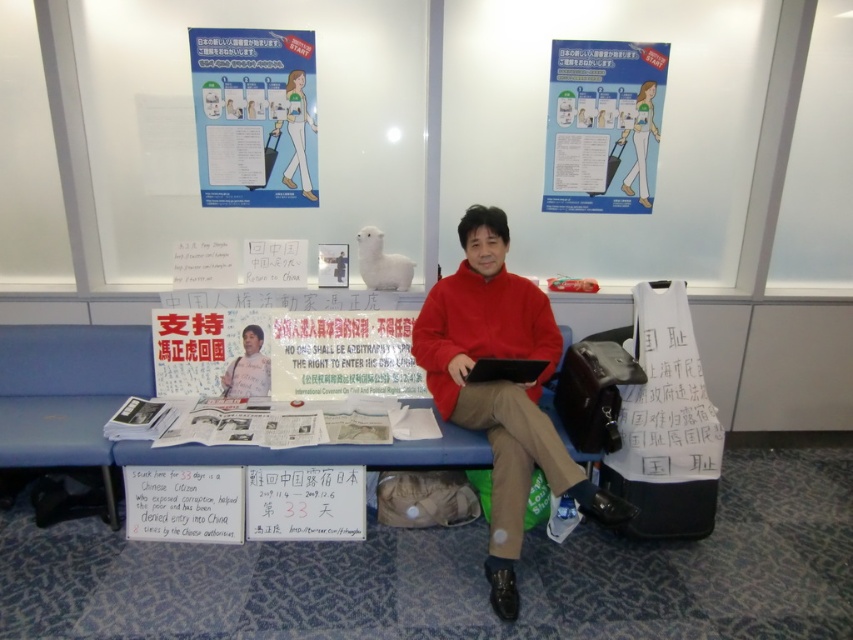
You are a traveler passing by the blue paper poster at upper left and the blue paper poster at upper center. Which poster is wider?

The blue paper poster at upper left is wider than the blue paper poster at upper center.

You are a photographer standing 10 feet away from the scene. You want to take a photo that includes both the blue paper poster at upper center and the matte red sweater at center. Is there enough space between them to fit both in the frame without moving closer?

The blue paper poster at upper center and matte red sweater at center are 5.34 feet apart from each other. Since you are 10 feet away, the distance between them is less than half your distance, so they should fit comfortably in the frame without needing to move closer.